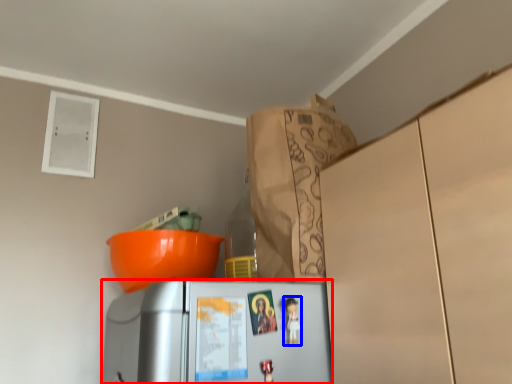
Question: Among these objects, which one is nearest to the camera, refrigerator (highlighted by a red box) or toy (highlighted by a blue box)?

Choices:
 (A) refrigerator
 (B) toy

Answer: (A)